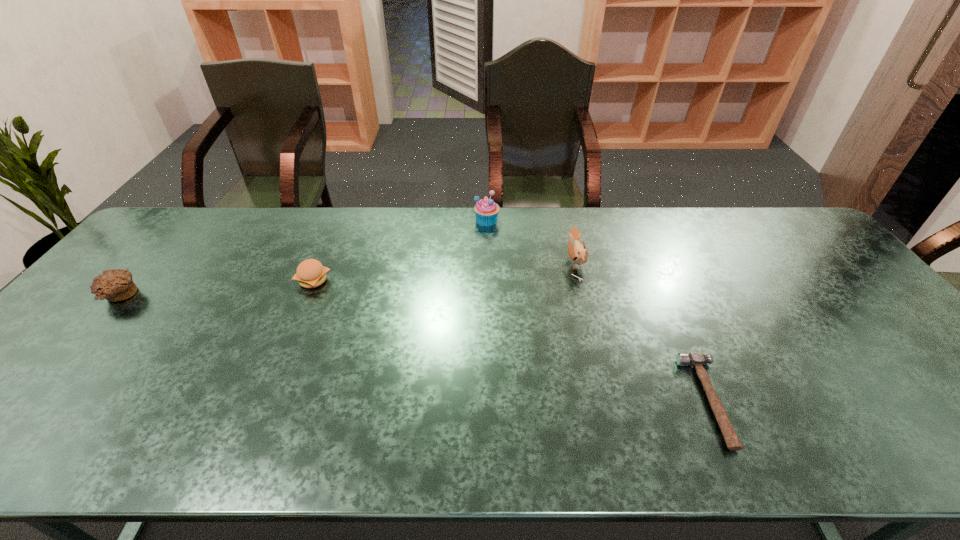
You are a GUI agent. You are given a task and a screenshot of the screen. Output one action in this format:
    pyautogui.click(x=<x>, y=<y>)
    Task: Click on the vacant space positioned 0.390m at the beak of the bird
    The image size is (960, 540).
    Given the screenshot: What is the action you would take?
    pyautogui.click(x=439, y=262)

This screenshot has width=960, height=540. Identify the location of vacant area located 0.390m at the beak of the bird. (439, 262).

Where is `vacant space positioned 0.240m on the right of the shorter muffin`? The height and width of the screenshot is (540, 960). vacant space positioned 0.240m on the right of the shorter muffin is located at coordinates (225, 296).

The width and height of the screenshot is (960, 540). I want to click on vacant space located 0.100m on the front of the hamburger, so click(298, 319).

Identify the location of free spot located 0.340m on the striking face of the shortest object. (540, 401).

This screenshot has height=540, width=960. I want to click on free space located 0.080m on the striking face of the shortest object, so click(656, 401).

Image resolution: width=960 pixels, height=540 pixels. Find the location of `vacant space located on the striking face of the shortest object`. vacant space located on the striking face of the shortest object is located at coordinates (562, 401).

You are a GUI agent. You are given a task and a screenshot of the screen. Output one action in this format:
    pyautogui.click(x=<x>, y=<y>)
    Task: Click on the muffin situated at the far edge
    
    Given the screenshot: What is the action you would take?
    pyautogui.click(x=486, y=210)

Locate an element on the screen. bird present at the far edge is located at coordinates [578, 253].

Locate an element on the screen. The height and width of the screenshot is (540, 960). object situated at the near edge is located at coordinates (695, 359).